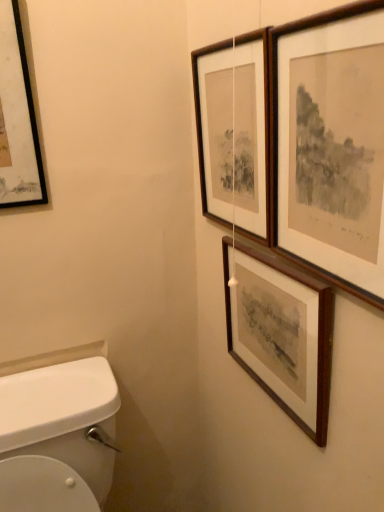
Question: Is wooden picture frame at upper right, which ranks as the second picture frame in left-to-right order, surrounding wooden framed print at upper right, marked as the 1th picture frame in a right-to-left arrangement?

Choices:
 (A) yes
 (B) no

Answer: (B)

Question: From a real-world perspective, is wooden picture frame at upper right, which is the 3th picture frame from right to left, beneath wooden framed print at upper right, the 4th picture frame in the left-to-right sequence?

Choices:
 (A) yes
 (B) no

Answer: (B)

Question: Is wooden picture frame at upper right, which ranks as the second picture frame in left-to-right order, at the right side of wooden framed print at upper right, the 4th picture frame in the left-to-right sequence?

Choices:
 (A) yes
 (B) no

Answer: (B)

Question: Does wooden picture frame at upper right, which is the 3th picture frame from right to left, turn towards wooden framed print at upper right, the 4th picture frame in the left-to-right sequence?

Choices:
 (A) yes
 (B) no

Answer: (B)

Question: Can you confirm if wooden picture frame at upper right, which ranks as the second picture frame in left-to-right order, is taller than wooden framed print at upper right, the 4th picture frame in the left-to-right sequence?

Choices:
 (A) yes
 (B) no

Answer: (A)

Question: In terms of size, does black matte picture frame at upper left, positioned as the first picture frame in left-to-right order, appear bigger or smaller than wooden picture frame at upper right, which ranks as the second picture frame in left-to-right order?

Choices:
 (A) big
 (B) small

Answer: (B)

Question: From a real-world perspective, is black matte picture frame at upper left, which is counted as the fourth picture frame, starting from the right, positioned above or below wooden picture frame at upper right, which ranks as the second picture frame in left-to-right order?

Choices:
 (A) below
 (B) above

Answer: (B)

Question: Is black matte picture frame at upper left, positioned as the first picture frame in left-to-right order, spatially inside wooden picture frame at upper right, which is the 3th picture frame from right to left, or outside of it?

Choices:
 (A) inside
 (B) outside

Answer: (B)

Question: Is black matte picture frame at upper left, which is counted as the fourth picture frame, starting from the right, in front of or behind wooden picture frame at upper right, which is the 3th picture frame from right to left, in the image?

Choices:
 (A) front
 (B) behind

Answer: (B)

Question: Considering the positions of wooden framed print at upper right, the 4th picture frame in the left-to-right sequence, and black matte picture frame at upper left, which is counted as the fourth picture frame, starting from the right, in the image, is wooden framed print at upper right, the 4th picture frame in the left-to-right sequence, wider or thinner than black matte picture frame at upper left, which is counted as the fourth picture frame, starting from the right,?

Choices:
 (A) thin
 (B) wide

Answer: (A)

Question: In terms of height, does wooden framed print at upper right, marked as the 1th picture frame in a right-to-left arrangement, look taller or shorter compared to black matte picture frame at upper left, positioned as the first picture frame in left-to-right order?

Choices:
 (A) tall
 (B) short

Answer: (B)

Question: Is point (309, 108) positioned closer to the camera than point (8, 158)?

Choices:
 (A) closer
 (B) farther

Answer: (A)

Question: Considering their positions, is wooden framed print at upper right, marked as the 1th picture frame in a right-to-left arrangement, located in front of or behind black matte picture frame at upper left, which is counted as the fourth picture frame, starting from the right?

Choices:
 (A) front
 (B) behind

Answer: (A)

Question: From the image's perspective, is wooden picture frame at upper right, the third picture frame from the left, above or below wooden picture frame at upper right, which is the 3th picture frame from right to left?

Choices:
 (A) below
 (B) above

Answer: (A)

Question: Is wooden picture frame at upper right, the second picture frame from the right, taller or shorter than wooden picture frame at upper right, which ranks as the second picture frame in left-to-right order?

Choices:
 (A) tall
 (B) short

Answer: (B)